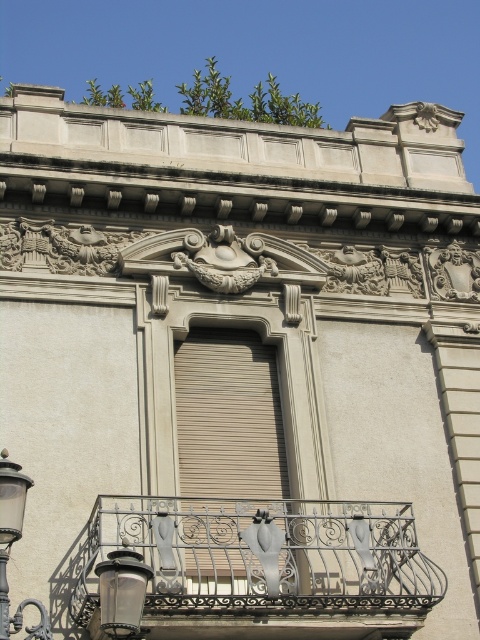
You are a window cleaner standing at the base of the building and need to clean both the decorative cornice with ornate carvings and moldings at the top and the matte black lantern at lower left. Given that your ladder can extend up to 20 meters, can you safely reach both objects with the ladder?

The distance between the decorative cornice with ornate carvings and moldings at the top and the matte black lantern at lower left is 23.59 meters. Since your ladder only extends up to 20 meters, you cannot safely reach both objects with the ladder.

You are a city planner assessing the lighting needs of this building facade. Given that both the matte black lantern at lower left and the metallic streetlamp at lower left are present, which one would you recommend for providing more illumination to the area in front of the building?

The metallic streetlamp at lower left is larger in size compared to the matte black lantern at lower left, so it would provide more illumination to the area in front of the building.